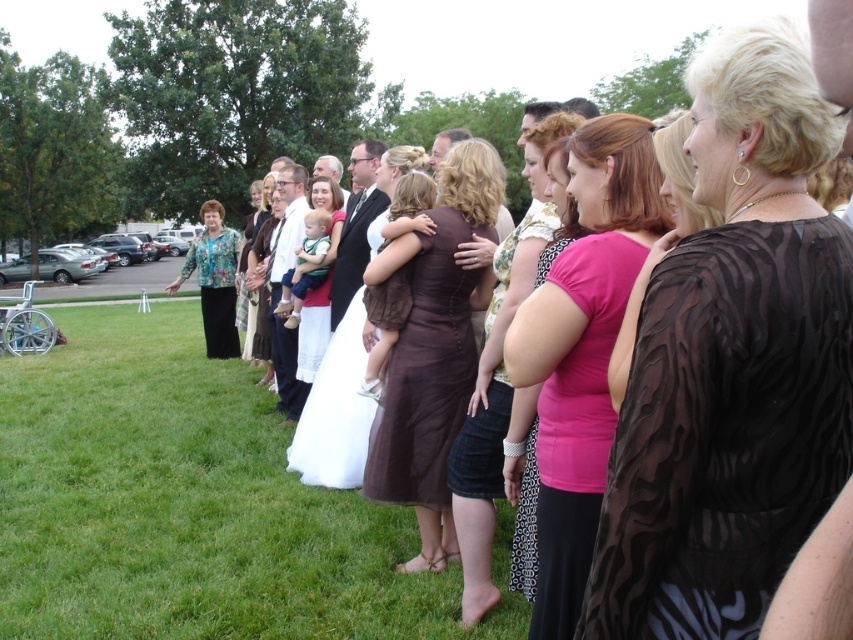
Who is lower down, green grass at lower left or floral-patterned fabric at left?

green grass at lower left

Can you confirm if green grass at lower left is wider than floral-patterned fabric at left?

Correct, the width of green grass at lower left exceeds that of floral-patterned fabric at left.

Locate an element on the screen. The height and width of the screenshot is (640, 853). green grass at lower left is located at coordinates (190, 504).

The width and height of the screenshot is (853, 640). Find the location of `green grass at lower left`. green grass at lower left is located at coordinates (190, 504).

Who is more distant from viewer, (440, 538) or (502, 381)?

The point (440, 538) is behind.

Is brown sheer dress at center further to the viewer compared to pink fabric dress at center?

That is True.

Which is in front, point (437, 509) or point (486, 481)?

Point (486, 481)

Image resolution: width=853 pixels, height=640 pixels. In order to click on brown sheer dress at center in this screenshot , I will do `click(434, 352)`.

Consider the image. Can you confirm if green grass at lower left is positioned to the right of pink sheer blouse at center?

In fact, green grass at lower left is to the left of pink sheer blouse at center.

Who is more forward, (230,516) or (651,211)?

Point (651,211) is more forward.

You are a GUI agent. You are given a task and a screenshot of the screen. Output one action in this format:
    pyautogui.click(x=<x>, y=<y>)
    Task: Click on the green grass at lower left
    This screenshot has width=853, height=640.
    Given the screenshot: What is the action you would take?
    pyautogui.click(x=190, y=504)